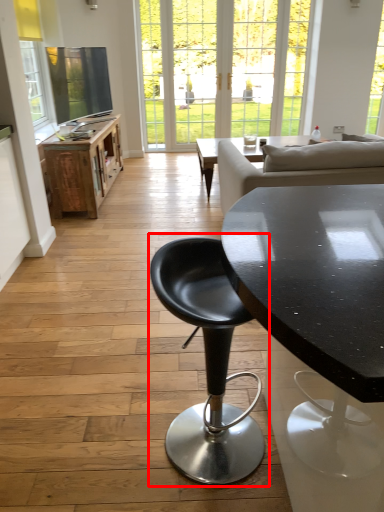
Question: Considering the relative positions of chair (annotated by the red box) and table in the image provided, where is chair (annotated by the red box) located with respect to the staircase?

Choices:
 (A) right
 (B) left

Answer: (A)